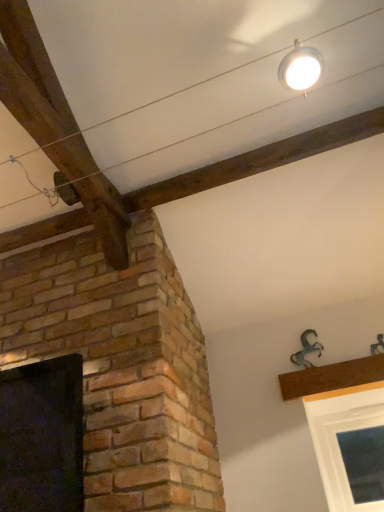
Question: Is black glass window at left taller than white glossy light fixture at upper center?

Choices:
 (A) yes
 (B) no

Answer: (A)

Question: Considering the relative positions of black glass window at left and white glossy light fixture at upper center in the image provided, is black glass window at left to the left of white glossy light fixture at upper center from the viewer's perspective?

Choices:
 (A) no
 (B) yes

Answer: (B)

Question: Is black glass window at left directly adjacent to white glossy light fixture at upper center?

Choices:
 (A) yes
 (B) no

Answer: (B)

Question: Can you confirm if black glass window at left is bigger than white glossy light fixture at upper center?

Choices:
 (A) no
 (B) yes

Answer: (B)

Question: Can you confirm if black glass window at left is shorter than white glossy light fixture at upper center?

Choices:
 (A) yes
 (B) no

Answer: (B)

Question: From a real-world perspective, is black glass window at left beneath white glossy light fixture at upper center?

Choices:
 (A) yes
 (B) no

Answer: (A)

Question: Considering the relative sizes of white glossy light fixture at upper center and black glass window at left in the image provided, is white glossy light fixture at upper center shorter than black glass window at left?

Choices:
 (A) no
 (B) yes

Answer: (B)

Question: Can you confirm if white glossy light fixture at upper center is positioned to the right of black glass window at left?

Choices:
 (A) yes
 (B) no

Answer: (A)

Question: Is white glossy light fixture at upper center located outside black glass window at left?

Choices:
 (A) yes
 (B) no

Answer: (A)

Question: Is white glossy light fixture at upper center closer to the viewer compared to black glass window at left?

Choices:
 (A) yes
 (B) no

Answer: (A)

Question: From the image's perspective, is white glossy light fixture at upper center above black glass window at left?

Choices:
 (A) no
 (B) yes

Answer: (B)

Question: Is black glass window at left surrounded by white glossy light fixture at upper center?

Choices:
 (A) no
 (B) yes

Answer: (A)

Question: Considering the positions of white glossy light fixture at upper center and black glass window at left in the image, is white glossy light fixture at upper center wider or thinner than black glass window at left?

Choices:
 (A) thin
 (B) wide

Answer: (A)